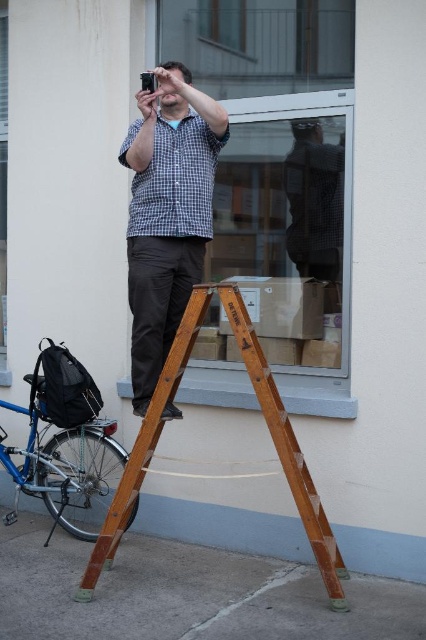
You are a delivery person who needs to place a package on the ground between the blue metallic bicycle at lower left and the checkered fabric shirt at upper center. What is the minimum distance you need to cover to ensure the package is placed exactly halfway between them?

The blue metallic bicycle at lower left and checkered fabric shirt at upper center are 1.64 meters apart from each other. To place the package exactly halfway, the minimum distance you need to cover is 0.82 meters from either object.

You are a pedestrian walking towards the blue metallic bicycle at lower left and the checkered fabric shirt at upper center. Which object will you see first as you approach?

The blue metallic bicycle at lower left will be seen first because it is positioned in front of the checkered fabric shirt at upper center.

You are a painter who needs to reach a spot 1.2 meters away from the wooden at center. Can you use the ladder to reach the checkered fabric shirt at upper center?

The wooden at center and checkered fabric shirt at upper center are 1.18 meters apart. Since the required distance is 1.2 meters, the ladder may not be sufficient to reach the checkered fabric shirt at upper center as it is slightly shorter than needed.